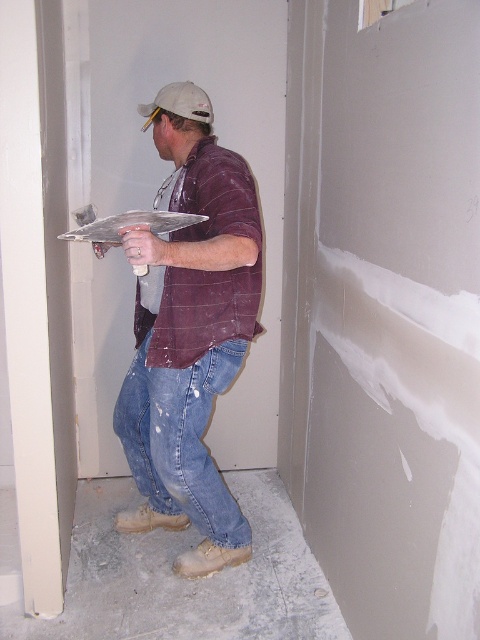
Based on the photo, is matte brown shirt at center below white smooth pillar at left?

Indeed, matte brown shirt at center is positioned under white smooth pillar at left.

Is point (127, 404) behind point (49, 154)?

Yes, it is behind point (49, 154).

Find the location of a particular element. The image size is (480, 640). matte brown shirt at center is located at coordinates point(190,342).

How far apart are white smooth pillar at left and white matte baseball hat at upper center?

white smooth pillar at left and white matte baseball hat at upper center are 24.61 inches apart.

Between point (16, 196) and point (177, 99), which one is positioned in front?

Point (16, 196)

Locate an element on the screen. This screenshot has width=480, height=640. white smooth pillar at left is located at coordinates click(x=36, y=292).

The width and height of the screenshot is (480, 640). What are the coordinates of `matte brown shirt at center` in the screenshot? It's located at (190, 342).

Is matte brown shirt at center shorter than denim jeans at center?

No.

Does point (216, 234) come in front of point (202, 492)?

Yes, it is in front of point (202, 492).

Identify the location of matte brown shirt at center. (190, 342).